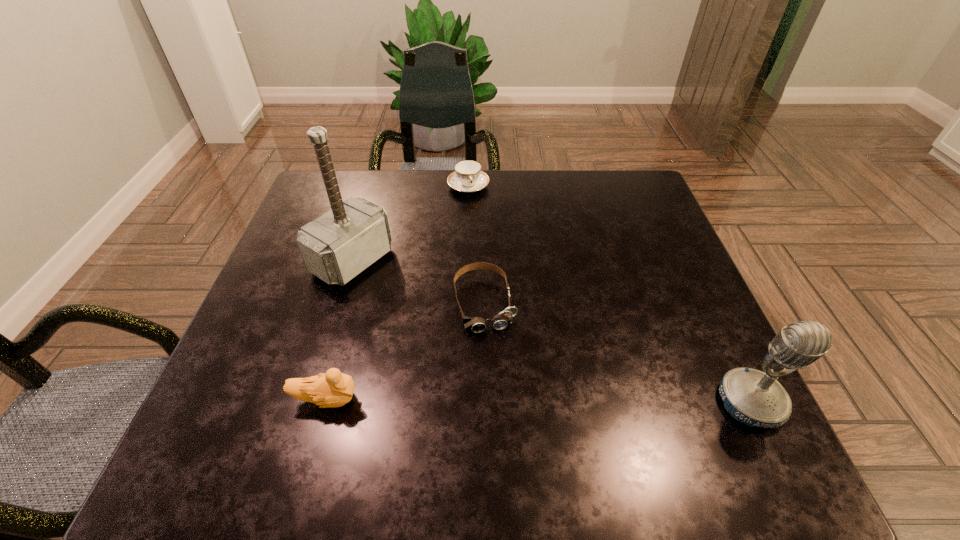
The width and height of the screenshot is (960, 540). Identify the location of duckling. [x=331, y=389].

What are the coordinates of `the second tallest object` in the screenshot? It's located at (754, 398).

The height and width of the screenshot is (540, 960). What are the coordinates of `microphone` in the screenshot? It's located at (754, 398).

Identify the location of hammer. (337, 246).

This screenshot has width=960, height=540. I want to click on goggles, so click(505, 318).

Locate an element on the screen. the farthest object is located at coordinates (467, 177).

Find the location of a particular element. This screenshot has height=540, width=960. vacant space located on the face of the third tallest object is located at coordinates (482, 399).

The image size is (960, 540). In order to click on vacant space situated 0.170m for striking with the head of the tallest object in this screenshot , I will do `click(436, 312)`.

At what (x,y) coordinates should I click in order to perform the action: click on free space located for striking with the head of the tallest object. Please return your answer as a coordinate pair (x, y). The height and width of the screenshot is (540, 960). Looking at the image, I should click on (405, 294).

Locate an element on the screen. This screenshot has width=960, height=540. free space located for striking with the head of the tallest object is located at coordinates pos(429,308).